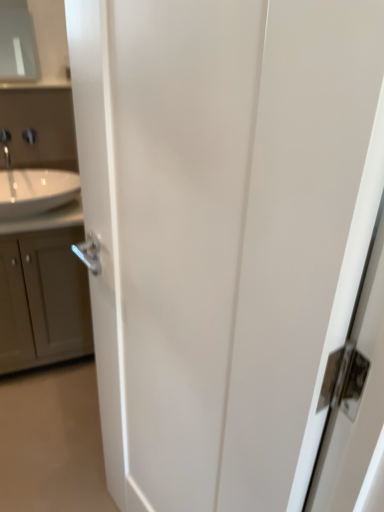
Question: Does white glossy sink at left come behind silver metallic tap at upper left?

Choices:
 (A) yes
 (B) no

Answer: (B)

Question: From the image's perspective, would you say white glossy sink at left is positioned over silver metallic tap at upper left?

Choices:
 (A) no
 (B) yes

Answer: (A)

Question: Is white glossy sink at left wider than silver metallic tap at upper left?

Choices:
 (A) yes
 (B) no

Answer: (A)

Question: Is white glossy sink at left closer to the viewer compared to silver metallic tap at upper left?

Choices:
 (A) no
 (B) yes

Answer: (B)

Question: From the image's perspective, would you say white glossy sink at left is shown under silver metallic tap at upper left?

Choices:
 (A) no
 (B) yes

Answer: (B)

Question: From a real-world perspective, relative to white glossy sink at left, is silver metallic tap at upper left vertically above or below?

Choices:
 (A) below
 (B) above

Answer: (B)

Question: Is silver metallic tap at upper left inside or outside of white glossy sink at left?

Choices:
 (A) inside
 (B) outside

Answer: (B)

Question: Considering the positions of silver metallic tap at upper left and white glossy sink at left in the image, is silver metallic tap at upper left wider or thinner than white glossy sink at left?

Choices:
 (A) wide
 (B) thin

Answer: (B)

Question: From the image's perspective, is silver metallic tap at upper left located above or below white glossy sink at left?

Choices:
 (A) above
 (B) below

Answer: (A)

Question: From the image's perspective, is satin nickel faucet at upper left positioned above or below silver metallic tap at upper left?

Choices:
 (A) above
 (B) below

Answer: (A)

Question: Considering the relative positions of satin nickel faucet at upper left and silver metallic tap at upper left in the image provided, is satin nickel faucet at upper left to the left or to the right of silver metallic tap at upper left?

Choices:
 (A) left
 (B) right

Answer: (B)

Question: In terms of size, does satin nickel faucet at upper left appear bigger or smaller than silver metallic tap at upper left?

Choices:
 (A) big
 (B) small

Answer: (B)

Question: From a real-world perspective, is satin nickel faucet at upper left positioned above or below silver metallic tap at upper left?

Choices:
 (A) above
 (B) below

Answer: (B)

Question: From a real-world perspective, is matte gray cabinet at left positioned above or below satin nickel faucet at upper left?

Choices:
 (A) below
 (B) above

Answer: (A)

Question: From their relative heights in the image, would you say matte gray cabinet at left is taller or shorter than satin nickel faucet at upper left?

Choices:
 (A) tall
 (B) short

Answer: (A)